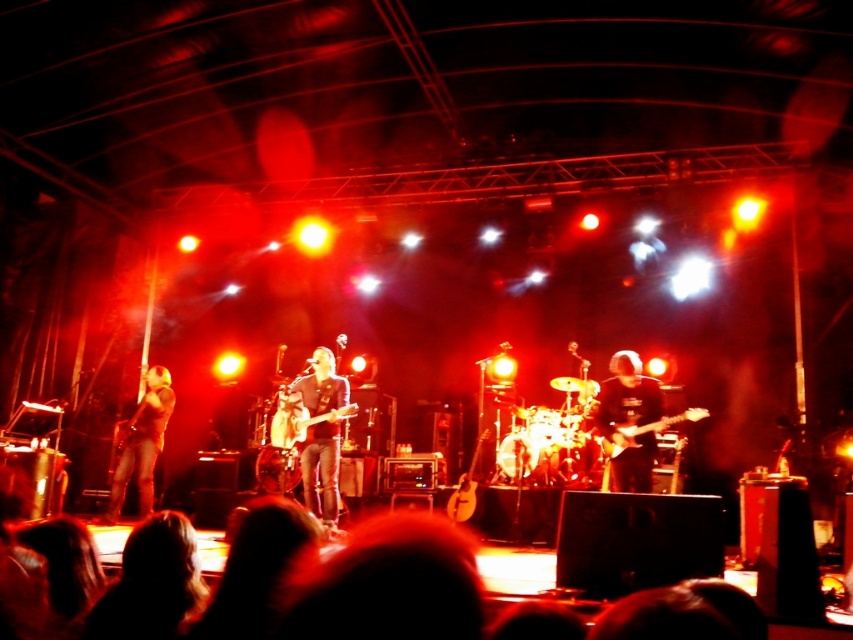
Describe the element at coordinates (630, 420) in the screenshot. I see `dark blue shirt at center` at that location.

Can you confirm if dark blue shirt at center is bigger than leather jacket at left?

Incorrect, dark blue shirt at center is not larger than leather jacket at left.

Image resolution: width=853 pixels, height=640 pixels. Find the location of `dark blue shirt at center`. dark blue shirt at center is located at coordinates (630, 420).

Is leather jacket at left bigger than matte black electric guitar at center?

Yes.

Where is `leather jacket at left`? leather jacket at left is located at coordinates (142, 444).

Is point (631, 476) farther from viewer compared to point (666, 426)?

No, (631, 476) is closer to viewer.

Who is lower down, dark blue shirt at center or matte black electric guitar at center?

matte black electric guitar at center is lower down.

Is point (610, 424) more distant than point (686, 413)?

Yes, point (610, 424) is farther from viewer.

Locate an element on the screen. The height and width of the screenshot is (640, 853). dark blue shirt at center is located at coordinates (630, 420).